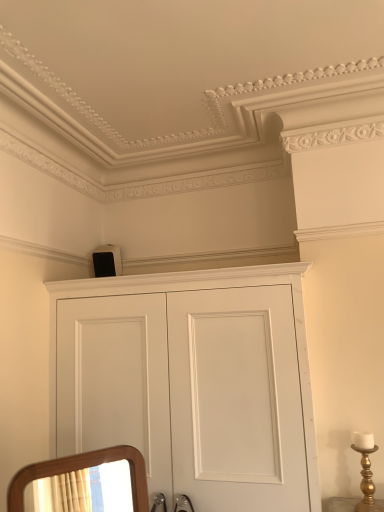
Question: Can you confirm if white matte cupboard at upper center is taller than gold metallic candle holder at right?

Choices:
 (A) yes
 (B) no

Answer: (A)

Question: Does white matte cupboard at upper center have a lesser height compared to gold metallic candle holder at right?

Choices:
 (A) yes
 (B) no

Answer: (B)

Question: Is the position of white matte cupboard at upper center less distant than that of gold metallic candle holder at right?

Choices:
 (A) yes
 (B) no

Answer: (A)

Question: Considering the relative sizes of white matte cupboard at upper center and gold metallic candle holder at right in the image provided, is white matte cupboard at upper center thinner than gold metallic candle holder at right?

Choices:
 (A) yes
 (B) no

Answer: (B)

Question: Is white matte cupboard at upper center to the left of gold metallic candle holder at right from the viewer's perspective?

Choices:
 (A) yes
 (B) no

Answer: (A)

Question: Is white matte cupboard at upper center at the right side of gold metallic candle holder at right?

Choices:
 (A) no
 (B) yes

Answer: (A)

Question: Is white matte speaker at upper center to the right of gold metallic candle holder at right from the viewer's perspective?

Choices:
 (A) no
 (B) yes

Answer: (A)

Question: From the image's perspective, does white matte speaker at upper center appear higher than gold metallic candle holder at right?

Choices:
 (A) yes
 (B) no

Answer: (A)

Question: Does white matte speaker at upper center have a smaller size compared to gold metallic candle holder at right?

Choices:
 (A) no
 (B) yes

Answer: (A)

Question: From a real-world perspective, is white matte speaker at upper center physically below gold metallic candle holder at right?

Choices:
 (A) yes
 (B) no

Answer: (B)

Question: Does white matte speaker at upper center have a greater width compared to gold metallic candle holder at right?

Choices:
 (A) yes
 (B) no

Answer: (A)

Question: From a real-world perspective, is white matte speaker at upper center physically above gold metallic candle holder at right?

Choices:
 (A) yes
 (B) no

Answer: (A)

Question: From a real-world perspective, is white matte cupboard at upper center under white matte speaker at upper center?

Choices:
 (A) no
 (B) yes

Answer: (B)